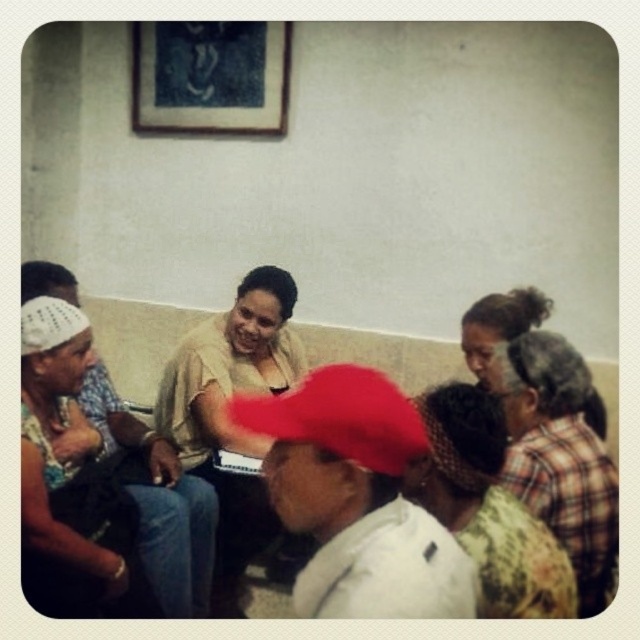
You are designing a display stand that needs to accommodate both the floral fabric headscarf at center and the blue fabric picture frame at upper center. Given their sizes, which object requires a wider space to be displayed properly?

The blue fabric picture frame at upper center requires a wider space because the floral fabric headscarf at center is narrower than it.

You are a photographer standing in front of the scene. You want to take a photo that includes both the floral fabric headscarf at center and the blue fabric picture frame at upper center. Which object will appear larger in your photo?

The floral fabric headscarf at center will appear larger in the photo because it is closer to the viewer than the blue fabric picture frame at upper center.

You are a tailor who needs to create a hat that matches the width of the blue fabric picture frame at upper center. The red fabric cap at center is currently 10 cm wide. What should be the minimum width of the new hat you design?

The red fabric cap at center is less than the blue fabric picture frame at upper center in width. Since the red fabric cap at center is 10 cm wide, the blue fabric picture frame at upper center must be wider than 10 cm. Therefore, the minimum width of the new hat should be just over 10 cm to match the blue fabric picture frame at upper center.